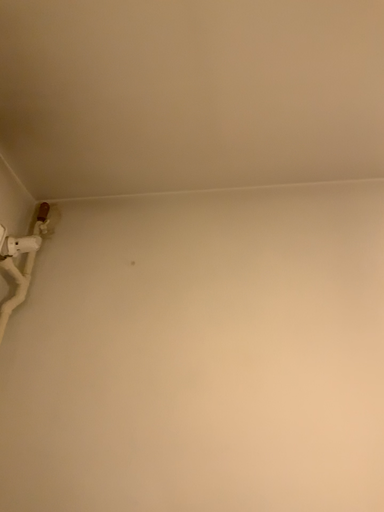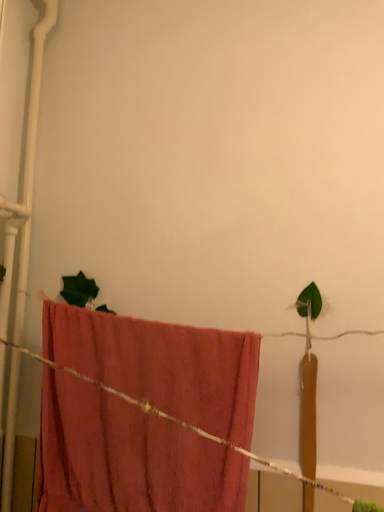
Question: Which way did the camera rotate in the video?

Choices:
 (A) rotated right
 (B) rotated left

Answer: (B)